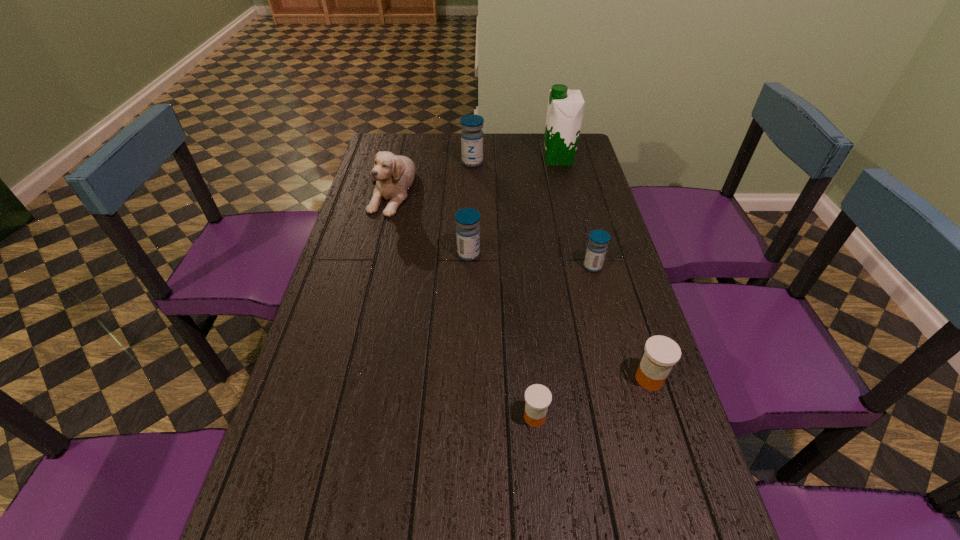
Identify the location of free space at the left edge of the desktop. The image size is (960, 540). (348, 331).

At what (x,y) coordinates should I click in order to perform the action: click on vacant space at the right edge of the desktop. Please return your answer as a coordinate pair (x, y). The height and width of the screenshot is (540, 960). Looking at the image, I should click on (611, 288).

Locate an element on the screen. free space at the far left corner of the desktop is located at coordinates (407, 146).

Identify the location of free space at the far right corner. The width and height of the screenshot is (960, 540). (581, 163).

You are a GUI agent. You are given a task and a screenshot of the screen. Output one action in this format:
    pyautogui.click(x=<x>, y=<y>)
    Task: Click on the free space that is in between the sixth farthest object and the smallest blue medicine
    The width and height of the screenshot is (960, 540).
    Given the screenshot: What is the action you would take?
    pyautogui.click(x=621, y=323)

In order to click on free space between the fourth shortest medicine and the puppy in this screenshot , I will do `click(430, 222)`.

Locate an element on the screen. free space between the second biggest blue medicine and the bigger orange medicine is located at coordinates (559, 316).

Locate an element on the screen. This screenshot has height=540, width=960. vacant space that's between the green soya milk and the rightmost blue medicine is located at coordinates (576, 213).

Where is `free space between the tallest medicine and the soya milk`? Image resolution: width=960 pixels, height=540 pixels. free space between the tallest medicine and the soya milk is located at coordinates (516, 161).

I want to click on object that is the sixth closest to the green soya milk, so click(538, 397).